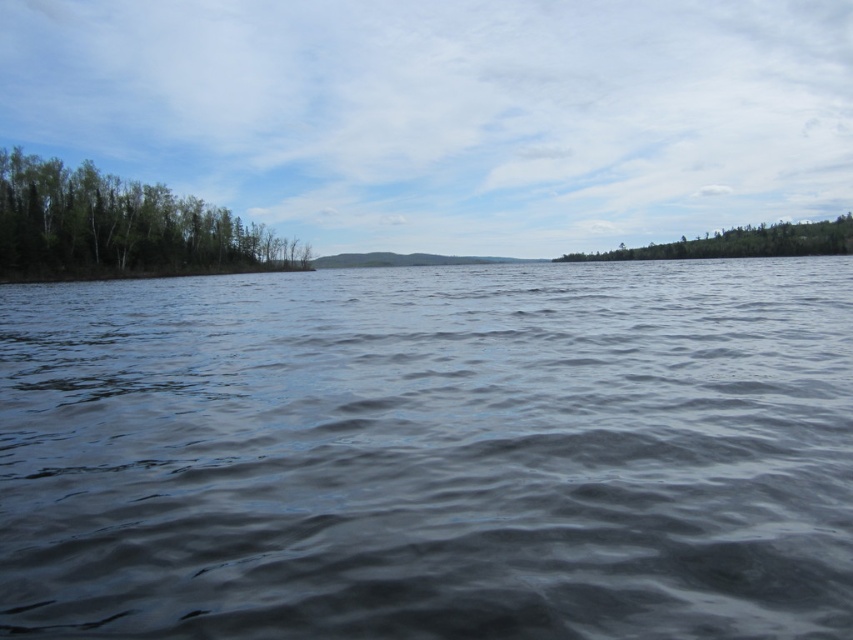
You are standing at the center of the image and want to walk towards the dark blue water at center. In which direction should you move?

The dark blue water at center is located at point 0.708 on the x and 0.506 on the y, so you should move towards the right and slightly forward to reach it.

You are standing on the lakeside and want to locate the point marked as point (431, 452). According to the scene, where exactly is this point located?

The point (431, 452) is on dark blue water at center.

You are an environmental scientist assessing the lake health. You observe the transparent water at center and the green leafy trees at right. Which object covers a larger area in the scene?

The transparent water at center has a larger size compared to green leafy trees at right, so the transparent water at center covers a larger area in the scene.